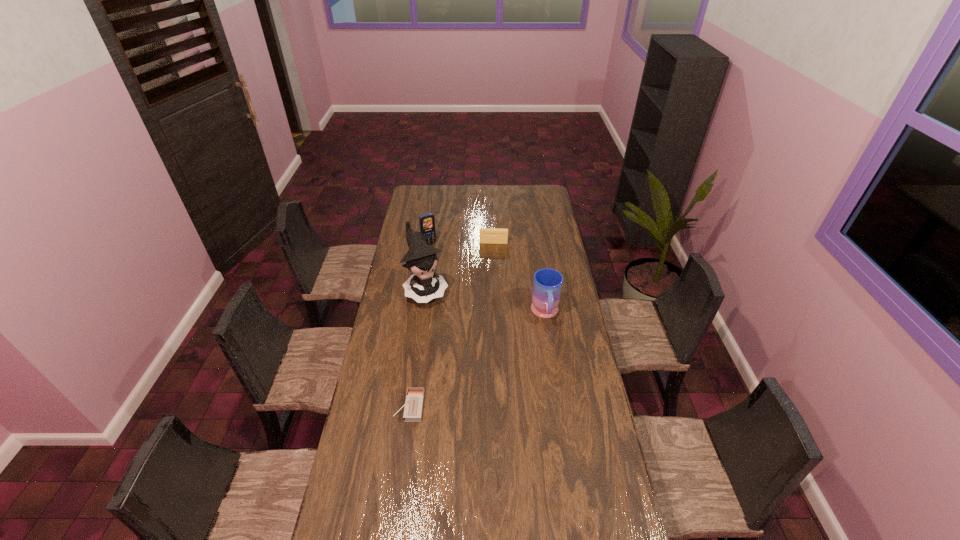
The image size is (960, 540). What are the coordinates of `free space between the nearest object and the tallest object` in the screenshot? It's located at (418, 348).

At what (x,y) coordinates should I click in order to perform the action: click on free space between the rightmost object and the tallest object. Please return your answer as a coordinate pair (x, y). Looking at the image, I should click on (486, 302).

This screenshot has width=960, height=540. Find the location of `unoccupied area between the mug and the cellular telephone`. unoccupied area between the mug and the cellular telephone is located at coordinates (487, 279).

The width and height of the screenshot is (960, 540). In order to click on free area in between the rightmost object and the nearest object in this screenshot , I will do `click(477, 360)`.

In order to click on vacant point located between the rightmost object and the doll in this screenshot , I will do `click(486, 302)`.

Locate an element on the screen. The image size is (960, 540). vacant space in between the shortest object and the rightmost object is located at coordinates (477, 360).

The height and width of the screenshot is (540, 960). Find the location of `object that is the second closest to the rightmost object`. object that is the second closest to the rightmost object is located at coordinates (486, 235).

Select which object appears as the third closest to the tallest object. Please provide its 2D coordinates. Your answer should be formatted as a tuple, i.e. [(x, y)], where the tuple contains the x and y coordinates of a point satisfying the conditions above.

[(547, 285)]

I want to click on free location that satisfies the following two spatial constraints: 1. on the front side of the tallest object; 2. on the left side of the cellular telephone, so click(x=422, y=289).

In order to click on free point that satisfies the following two spatial constraints: 1. on the front side of the matchbox; 2. on the striking surface of the cellular telephone in this screenshot , I will do `click(405, 407)`.